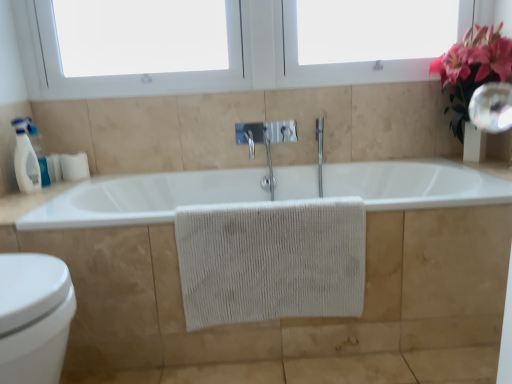
Locate an element on the screen. vacant space underneath white glossy counter top at lower left (from a real-world perspective) is located at coordinates (38, 196).